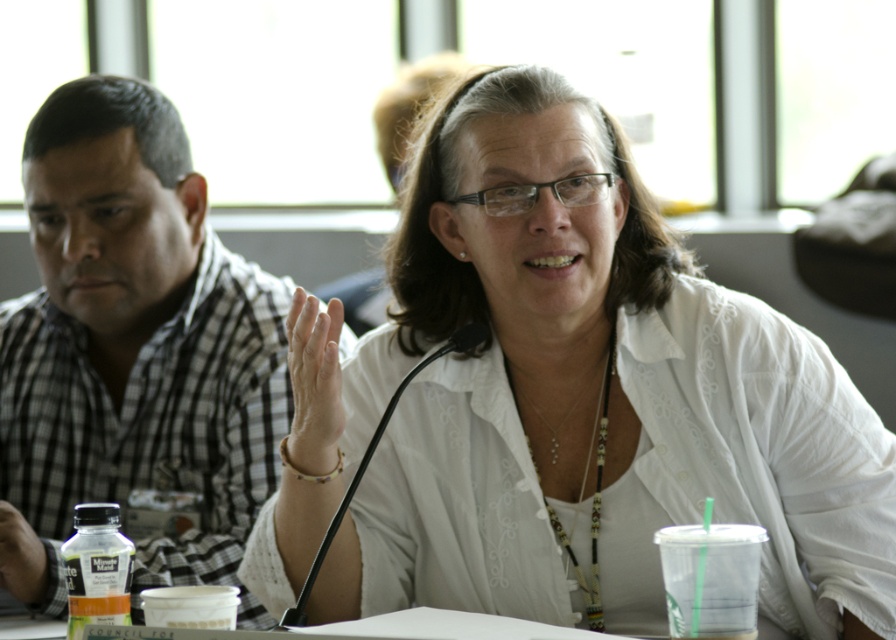
Which is behind, point (332, 371) or point (27, 573)?

Point (27, 573)

Based on the photo, who is lower down, white matte hand at center or matte plastic bottle at lower left?

matte plastic bottle at lower left is lower down.

Where is `white matte hand at center`? The height and width of the screenshot is (640, 896). white matte hand at center is located at coordinates (314, 381).

Is white matte shirt at center shorter than white matte hand at center?

No.

Who is more forward, (x=365, y=358) or (x=320, y=381)?

Point (x=320, y=381)

Identify the location of white matte shirt at center. (576, 400).

Looking at this image, is checkered fabric shirt at left to the left of matte plastic bottle at lower left from the viewer's perspective?

No, checkered fabric shirt at left is not to the left of matte plastic bottle at lower left.

Which is more to the right, checkered fabric shirt at left or matte plastic bottle at lower left?

From the viewer's perspective, checkered fabric shirt at left appears more on the right side.

Is point (128, 365) positioned after point (16, 566)?

Yes, it is behind point (16, 566).

At what (x,y) coordinates should I click in order to perform the action: click on checkered fabric shirt at left. Please return your answer as a coordinate pair (x, y). Looking at the image, I should click on (136, 346).